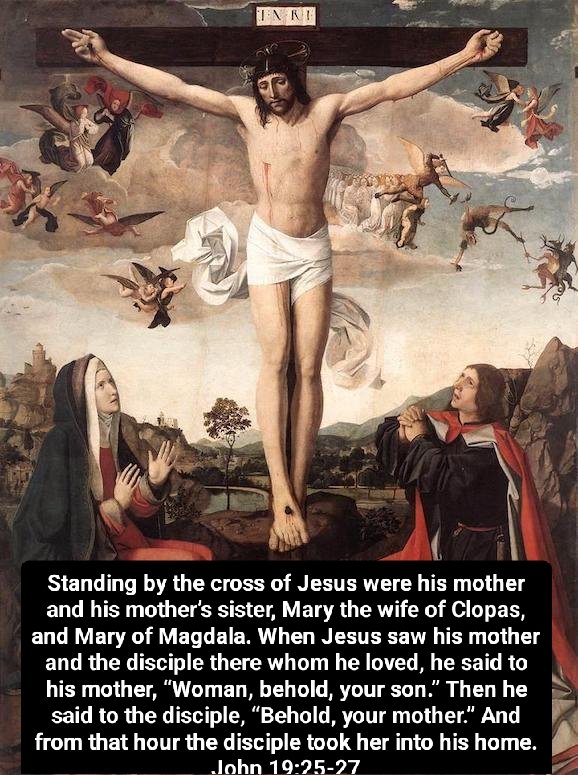
Locate an element on the screen. painting is located at coordinates (536, 38).